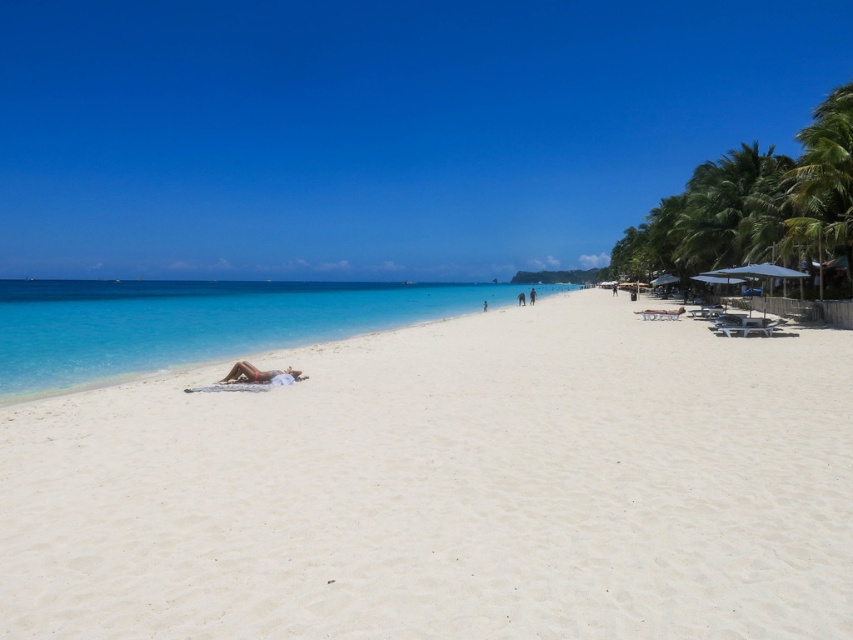
You are a lifeguard on duty and notice the tan skin person at center lying on the beach. Can you see their entire body from above the clear blue water at center?

The clear blue water at center is positioned over the tan skin person at center, so their body is partially submerged or covered by the water, making it impossible to see their entire body from above.

You are standing on the white sandy beach at center and want to walk towards the green leafy palm tree at upper right. In which direction should you head?

You should head to the right because the white sandy beach at center is to the left of the green leafy palm tree at upper right, meaning the palm tree is located to your right side.